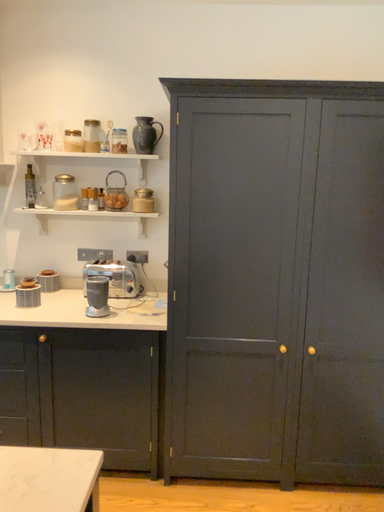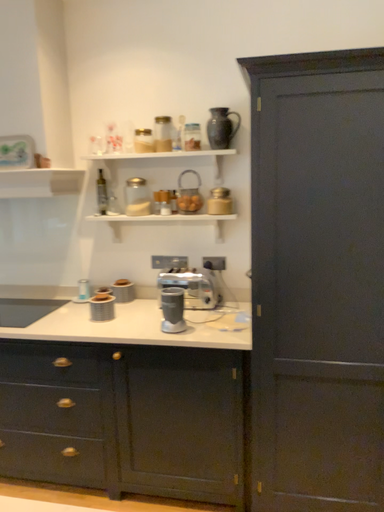
Question: Which way did the camera rotate in the video?

Choices:
 (A) rotated left
 (B) rotated right

Answer: (A)